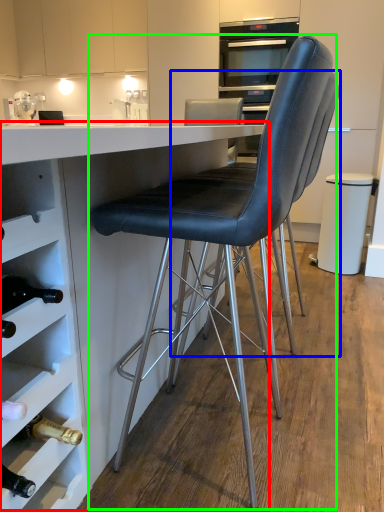
Question: Based on their relative distances, which object is farther from table (highlighted by a red box)? Choose from chair (highlighted by a blue box) and chair (highlighted by a green box).

Choices:
 (A) chair
 (B) chair

Answer: (A)